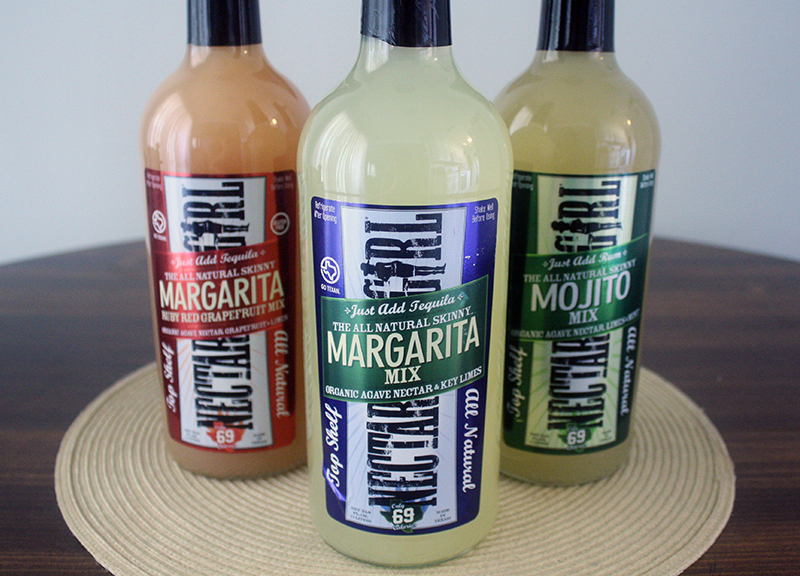
The height and width of the screenshot is (576, 800). I want to click on bottle, so click(553, 328).